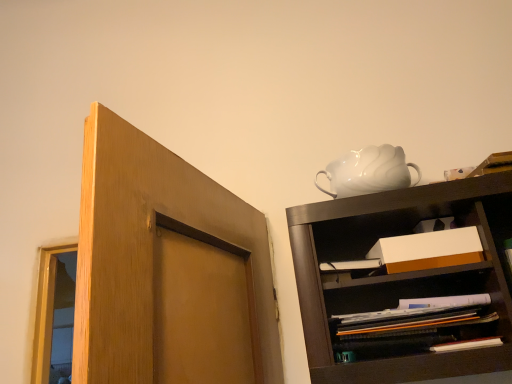
Question: Does white cardboard box at center appear on the left side of white glossy teapot at upper right?

Choices:
 (A) yes
 (B) no

Answer: (B)

Question: From the image's perspective, is white cardboard box at center beneath white glossy teapot at upper right?

Choices:
 (A) no
 (B) yes

Answer: (B)

Question: Can you confirm if white cardboard box at center is smaller than white glossy teapot at upper right?

Choices:
 (A) no
 (B) yes

Answer: (B)

Question: Is white cardboard box at center positioned with its back to white glossy teapot at upper right?

Choices:
 (A) yes
 (B) no

Answer: (B)

Question: Can you confirm if white cardboard box at center is shorter than white glossy teapot at upper right?

Choices:
 (A) yes
 (B) no

Answer: (A)

Question: Does white cardboard box at center have a larger size compared to white glossy teapot at upper right?

Choices:
 (A) yes
 (B) no

Answer: (B)

Question: Considering the relative positions of white glossy teapot at upper right and white cardboard box at center in the image provided, is white glossy teapot at upper right behind white cardboard box at center?

Choices:
 (A) yes
 (B) no

Answer: (A)

Question: From a real-world perspective, is white glossy teapot at upper right located higher than white cardboard box at center?

Choices:
 (A) yes
 (B) no

Answer: (A)

Question: Is white glossy teapot at upper right positioned beyond the bounds of white cardboard box at center?

Choices:
 (A) yes
 (B) no

Answer: (A)

Question: Does white glossy teapot at upper right turn towards white cardboard box at center?

Choices:
 (A) no
 (B) yes

Answer: (A)

Question: From the image's perspective, is white glossy teapot at upper right located above white cardboard box at center?

Choices:
 (A) no
 (B) yes

Answer: (B)

Question: Considering the relative sizes of white glossy teapot at upper right and white cardboard box at center in the image provided, is white glossy teapot at upper right thinner than white cardboard box at center?

Choices:
 (A) yes
 (B) no

Answer: (B)

Question: Can you confirm if matte brown shelf at lower right is shorter than white cardboard box at center?

Choices:
 (A) yes
 (B) no

Answer: (B)